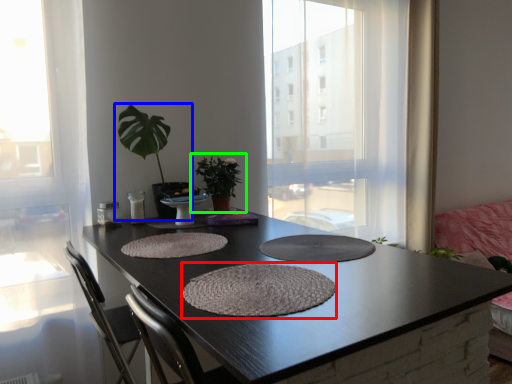
Question: Estimate the real-world distances between objects in this image. Which object is closer to wide (highlighted by a red box), houseplant (highlighted by a blue box) or houseplant (highlighted by a green box)?

Choices:
 (A) houseplant
 (B) houseplant

Answer: (A)